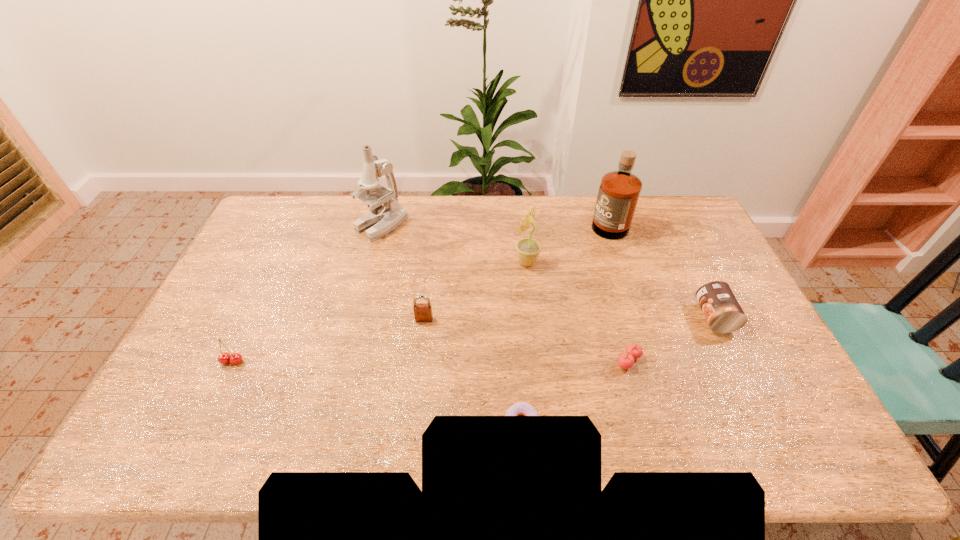
Where is `blank space located 0.230m on the front label of the can`? This screenshot has width=960, height=540. blank space located 0.230m on the front label of the can is located at coordinates (620, 318).

In order to click on free space located on the front label of the can in this screenshot , I will do `click(576, 318)`.

Locate an element on the screen. The image size is (960, 540). vacant region located 0.150m with the stems of the left cherry pointing upwards is located at coordinates (205, 419).

You are a GUI agent. You are given a task and a screenshot of the screen. Output one action in this format:
    pyautogui.click(x=<x>, y=<y>)
    Task: Click on the vacant position located 0.380m on the back of the shorter cherry
    
    Given the screenshot: What is the action you would take?
    click(x=599, y=258)

Find the location of a particular element. This screenshot has width=960, height=540. free space located 0.220m on the right of the nearest object is located at coordinates (630, 422).

At what (x,y) coordinates should I click in order to perform the action: click on microscope located at the far edge. Please return your answer as a coordinate pair (x, y). Looking at the image, I should click on (382, 219).

At what (x,y) coordinates should I click in order to perform the action: click on liquor situated at the far edge. Please return your answer as a coordinate pair (x, y). This screenshot has height=540, width=960. Looking at the image, I should click on [x=619, y=191].

Where is `object that is at the near edge`? This screenshot has height=540, width=960. object that is at the near edge is located at coordinates (521, 408).

The height and width of the screenshot is (540, 960). I want to click on object present at the left edge, so click(224, 358).

The width and height of the screenshot is (960, 540). I want to click on object that is at the right edge, so click(x=719, y=305).